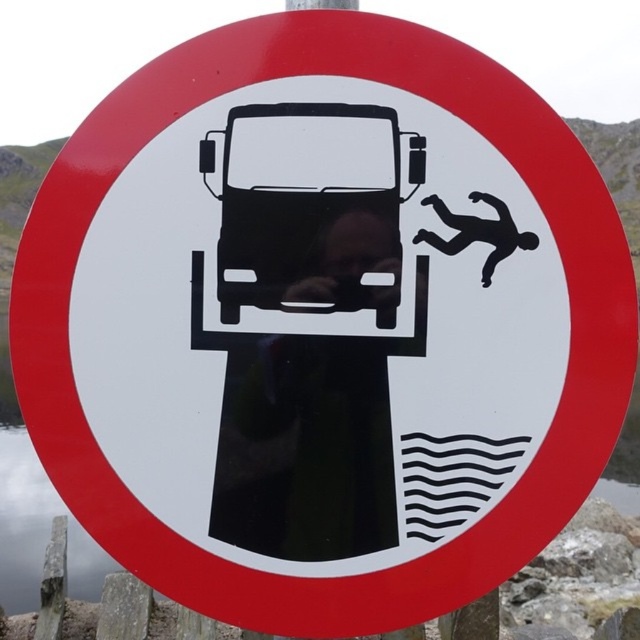
Question: Which of the following is the farthest from the observer?

Choices:
 (A) black glossy car at center
 (B) wavy lines water at lower center

Answer: (B)

Question: From the image, what is the correct spatial relationship of black glossy car at center in relation to wavy lines water at lower center?

Choices:
 (A) below
 (B) above

Answer: (B)

Question: Does black glossy car at center have a greater width compared to wavy lines water at lower center?

Choices:
 (A) yes
 (B) no

Answer: (B)

Question: Which of the following is the closest to the observer?

Choices:
 (A) black glossy car at center
 (B) wavy lines water at lower center

Answer: (A)

Question: Which object appears farthest from the camera in this image?

Choices:
 (A) wavy lines water at lower center
 (B) black glossy car at center

Answer: (A)

Question: Can you confirm if black glossy car at center is positioned to the left of wavy lines water at lower center?

Choices:
 (A) yes
 (B) no

Answer: (B)